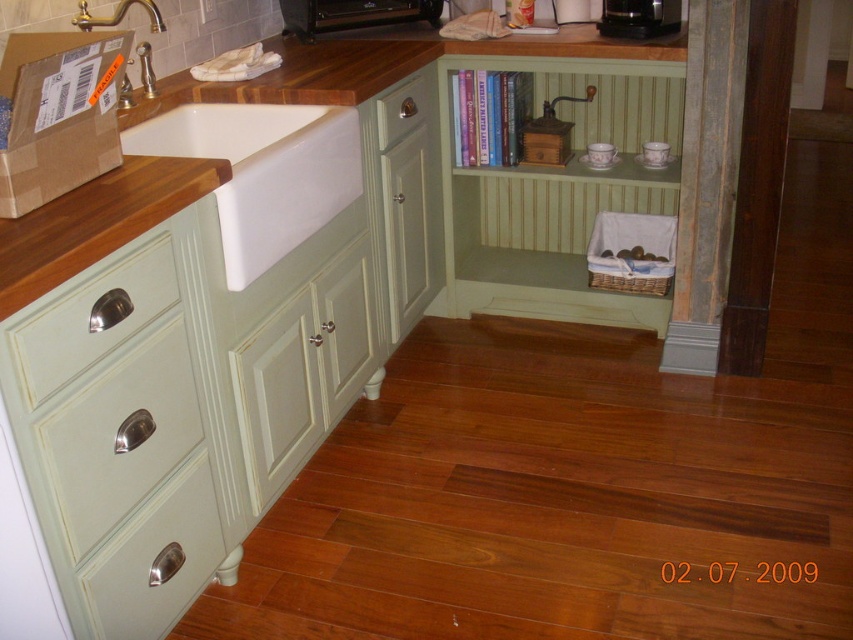
Between point (33, 252) and point (68, 378), which one is positioned behind?

Positioned behind is point (68, 378).

Measure the distance from brown wood countertop at upper left to white glossy drawer at lower left.

The distance of brown wood countertop at upper left from white glossy drawer at lower left is 4.19 inches.

I want to click on brown wood countertop at upper left, so click(96, 221).

Which is in front, point (73, 264) or point (384, 134)?

Positioned in front is point (73, 264).

Which is below, brown wood countertop at upper left or satin nickel drawer at center?

brown wood countertop at upper left is lower down.

Who is more forward, (178,184) or (426,106)?

Point (178,184)

At what (x,y) coordinates should I click in order to perform the action: click on brown wood countertop at upper left. Please return your answer as a coordinate pair (x, y). Looking at the image, I should click on (96, 221).

This screenshot has width=853, height=640. What are the coordinates of `white glossy drawer at lower left` in the screenshot? It's located at (91, 321).

Between white glossy drawer at lower left and gold polished faucet at upper left, which one is positioned higher?

gold polished faucet at upper left is higher up.

The height and width of the screenshot is (640, 853). Identify the location of white glossy drawer at lower left. (91, 321).